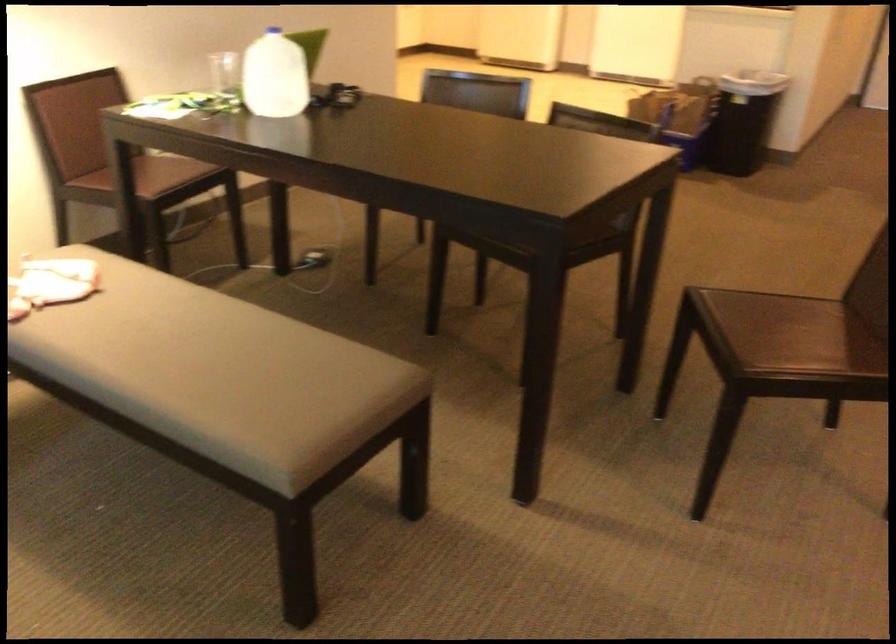
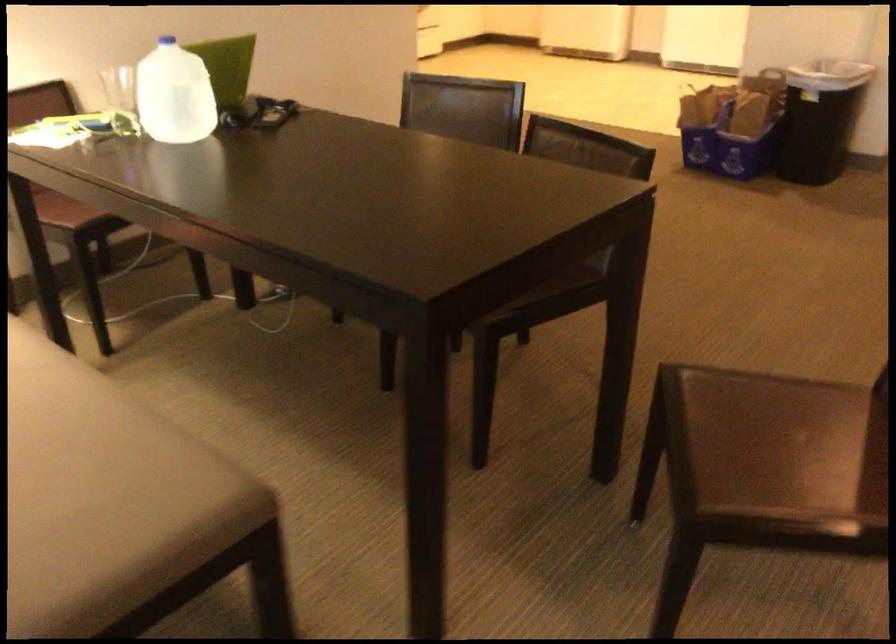
Question: The images are taken continuously from a first-person perspective. In which direction is your viewpoint rotating?

Choices:
 (A) Left
 (B) Right
 (C) Up
 (D) Down

Answer: (A)